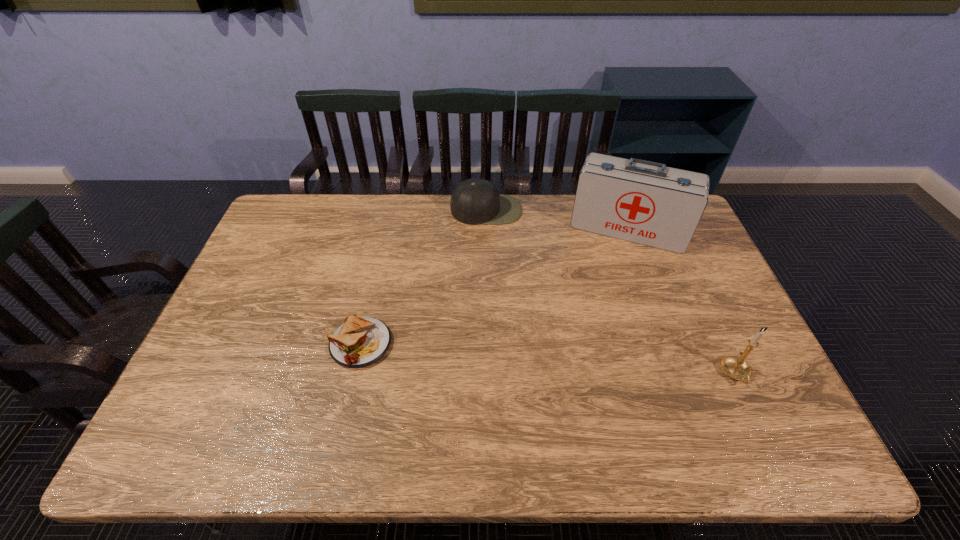
Identify the location of vacant space located 0.320m on the front-facing side of the tallest object. (594, 326).

Identify the location of vacant space located on the brim of the second object from left to right. (494, 294).

This screenshot has height=540, width=960. In order to click on vacant space situated 0.090m on the brim of the second object from left to right in this screenshot , I will do `click(490, 242)`.

You are a GUI agent. You are given a task and a screenshot of the screen. Output one action in this format:
    pyautogui.click(x=<x>, y=<y>)
    Task: Click on the free region located on the brim of the second object from left to right
    The width and height of the screenshot is (960, 540).
    Given the screenshot: What is the action you would take?
    pyautogui.click(x=493, y=284)

Where is `the first-aid kit present at the far edge`? This screenshot has width=960, height=540. the first-aid kit present at the far edge is located at coordinates (644, 202).

Locate an element on the screen. cap at the far edge is located at coordinates (474, 201).

This screenshot has width=960, height=540. In order to click on object that is at the near edge in this screenshot , I will do `click(736, 367)`.

Find the location of a particular element. The image size is (960, 540). candle holder positioned at the right edge is located at coordinates (736, 367).

Where is `the first-aid kit present at the right edge`? the first-aid kit present at the right edge is located at coordinates (644, 202).

You are a GUI agent. You are given a task and a screenshot of the screen. Output one action in this format:
    pyautogui.click(x=<x>, y=<y>)
    Task: Click on the object located in the far right corner section of the desktop
    The width and height of the screenshot is (960, 540).
    Given the screenshot: What is the action you would take?
    pyautogui.click(x=644, y=202)